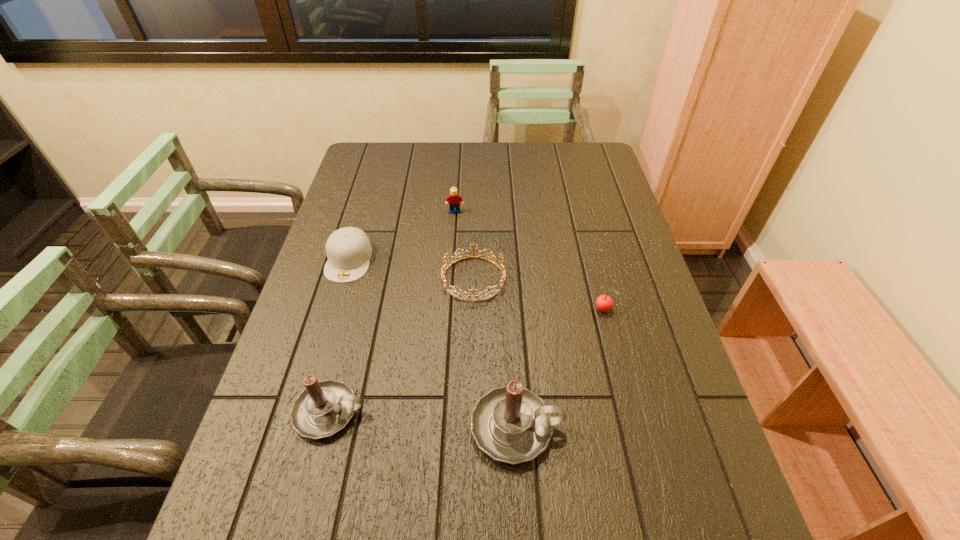
The height and width of the screenshot is (540, 960). I want to click on free space between the cherry and the shorter candle, so click(x=467, y=361).

At what (x,y) coordinates should I click in order to perform the action: click on empty location between the farthest object and the cap. Please return your answer as a coordinate pair (x, y). The image size is (960, 540). Looking at the image, I should click on (402, 235).

Image resolution: width=960 pixels, height=540 pixels. Find the location of `vacant area that lies between the taller candle and the tiara`. vacant area that lies between the taller candle and the tiara is located at coordinates (495, 353).

The width and height of the screenshot is (960, 540). Find the location of `vacant space that's between the second tallest object and the tiara`. vacant space that's between the second tallest object and the tiara is located at coordinates click(401, 346).

Choose which object is the fourth nearest neighbor to the cherry. Please provide its 2D coordinates. Your answer should be formatted as a tuple, i.e. [(x, y)], where the tuple contains the x and y coordinates of a point satisfying the conditions above.

[(324, 408)]

You are a GUI agent. You are given a task and a screenshot of the screen. Output one action in this format:
    pyautogui.click(x=<x>, y=<y>)
    Task: Click on the second closest object to the right candle
    
    Given the screenshot: What is the action you would take?
    pyautogui.click(x=604, y=303)

You are a GUI agent. You are given a task and a screenshot of the screen. Output one action in this format:
    pyautogui.click(x=<x>, y=<y>)
    Task: Click on the vacant space that satisfies the following two spatial constraints: 1. on the front-facing side of the tiara; 2. on the left side of the cherry
    
    Given the screenshot: What is the action you would take?
    pyautogui.click(x=473, y=310)

The height and width of the screenshot is (540, 960). In order to click on vacant point that satisfies the following two spatial constraints: 1. on the front-facing side of the shortest object; 2. on the right side of the cherry in this screenshot , I will do 473,310.

Locate an element on the screen. free space that satisfies the following two spatial constraints: 1. on the front-facing side of the fifth tallest object; 2. on the right side of the cherry is located at coordinates (334, 310).